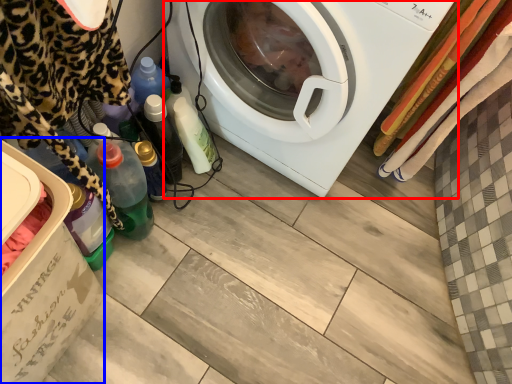
Question: Among these objects, which one is farthest to the camera, washing machine (highlighted by a red box) or dish washer (highlighted by a blue box)?

Choices:
 (A) washing machine
 (B) dish washer

Answer: (A)